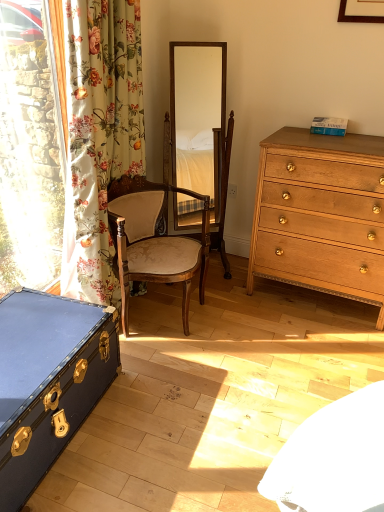
Locate an element on the screen. vacant space in front of wooden chair at center is located at coordinates (177, 376).